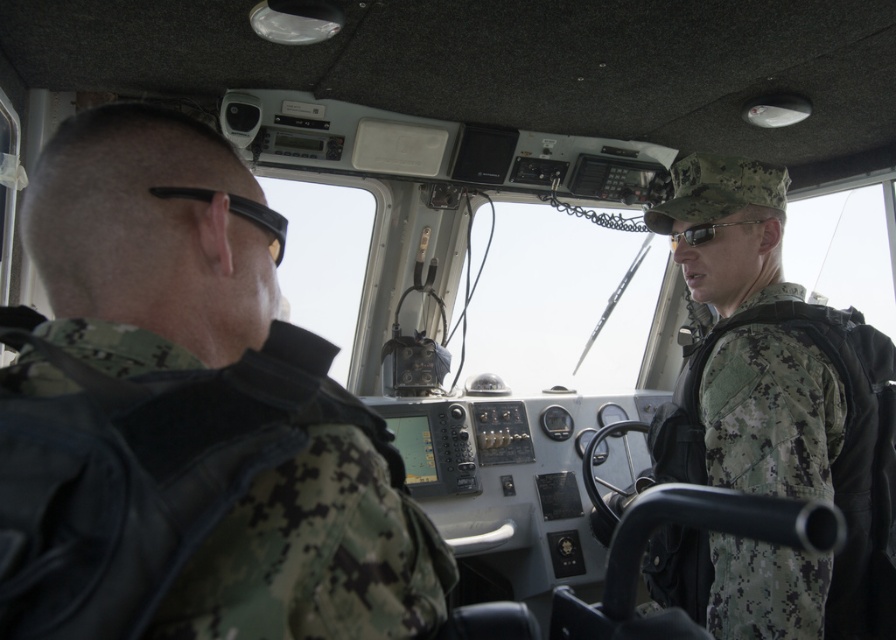
You are a technician inspecting the cockpit controls. You notice two items on the control panel. The first is the black rubber goggles at left and the second is the sunglasses at center. Which item takes up more space on the control panel?

The sunglasses at center takes up more space on the control panel than the black rubber goggles at left.

You are inside the cockpit of a military vehicle and need to reach a control panel located at point A and point B. The coordinates for point A are point (x=192, y=180) and point B are point (x=271, y=218). Which point is closer to you?

Point (x=192, y=180) is closer to the camera than point (x=271, y=218), so you should reach for point A first as it is nearer to your current position in the cockpit.